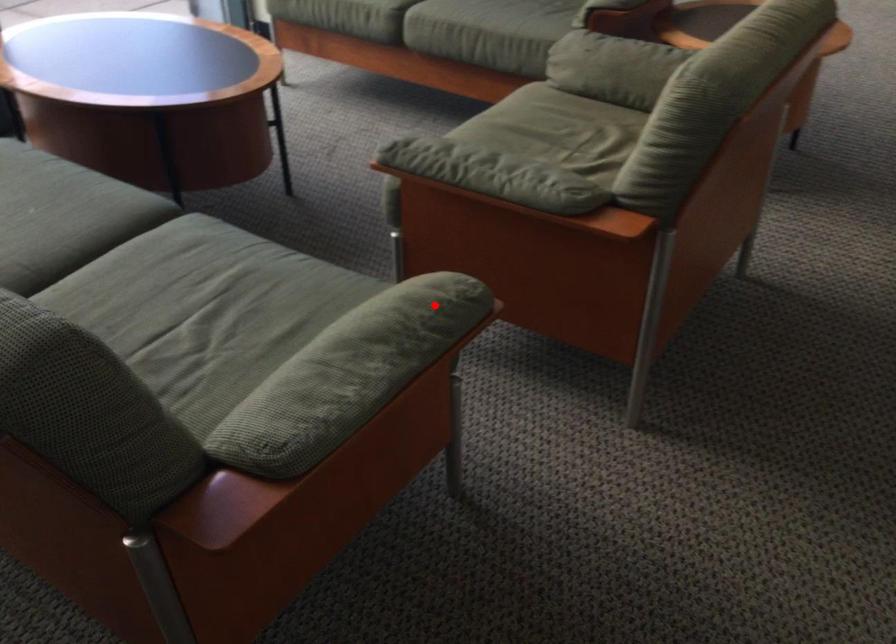
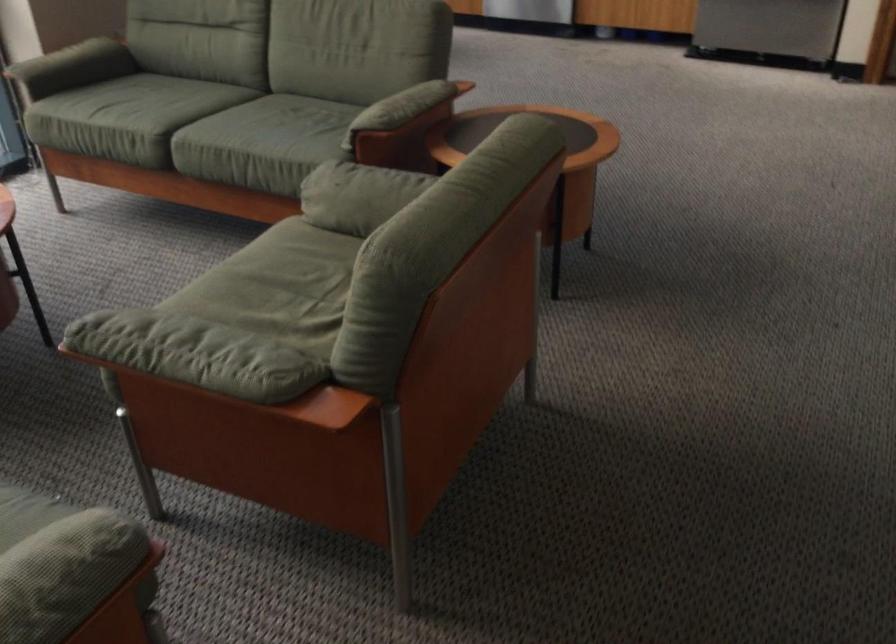
The point at the highlighted location is marked in the first image. Where is the corresponding point in the second image?

(71, 559)